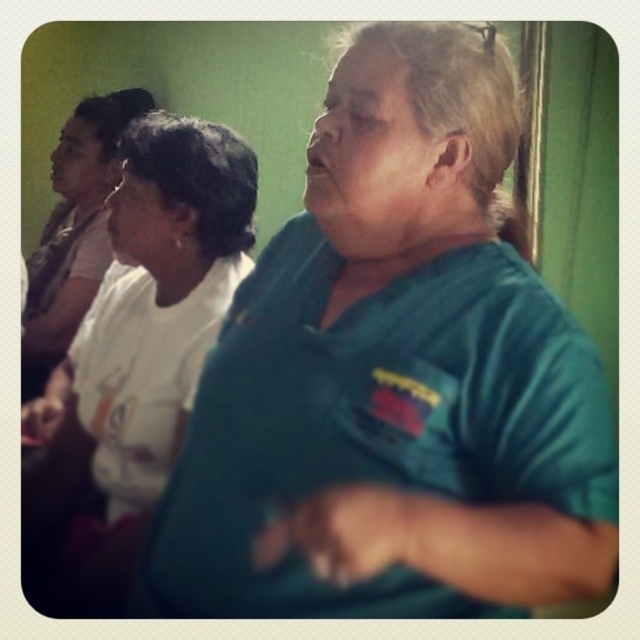
Looking at this image, you are an event planner arranging a photo shoot. You need to ensure that the teal fabric shirt at center and the white matte shirt at upper left are visible in the final shot. Based on their positions, which shirt should be moved to ensure both are fully visible?

The white matte shirt at upper left should be moved because the teal fabric shirt at center is positioned under it, which may block part of the white matte shirt at upper left if not adjusted.